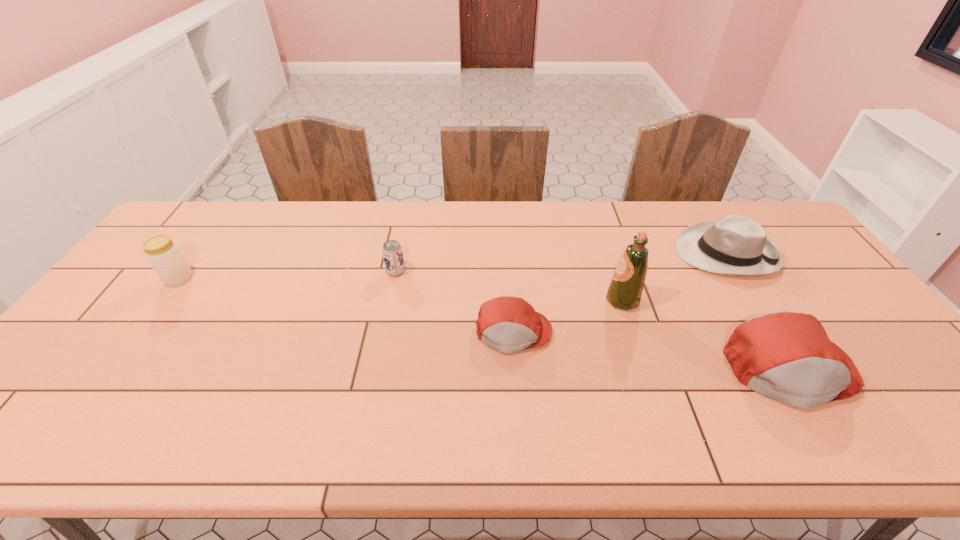
The image size is (960, 540). I want to click on the shorter cap, so 508,324.

Image resolution: width=960 pixels, height=540 pixels. In order to click on the left cap in this screenshot , I will do `click(508, 324)`.

Where is `the right cap`? the right cap is located at coordinates (787, 356).

Where is `fedora`? The width and height of the screenshot is (960, 540). fedora is located at coordinates (736, 245).

Where is `the fifth object from right to left`? the fifth object from right to left is located at coordinates (392, 253).

The image size is (960, 540). What are the coordinates of `olive oil` in the screenshot? It's located at (625, 290).

Locate an element on the screen. The image size is (960, 540). the third object from right to left is located at coordinates tap(625, 290).

At what (x,y) coordinates should I click in order to perform the action: click on jar. Please return your answer as a coordinate pair (x, y). Looking at the image, I should click on (164, 256).

Where is `free location located on the front-facing side of the left cap`? The height and width of the screenshot is (540, 960). free location located on the front-facing side of the left cap is located at coordinates (517, 387).

Image resolution: width=960 pixels, height=540 pixels. In order to click on free spot located on the front-facing side of the fedora in this screenshot , I will do `click(592, 253)`.